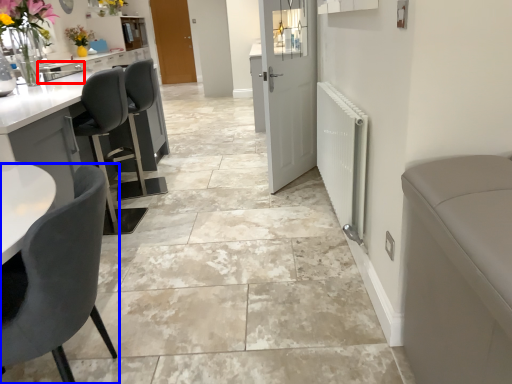
Question: Which object is further to the camera taking this photo, sink (highlighted by a red box) or chair (highlighted by a blue box)?

Choices:
 (A) sink
 (B) chair

Answer: (A)